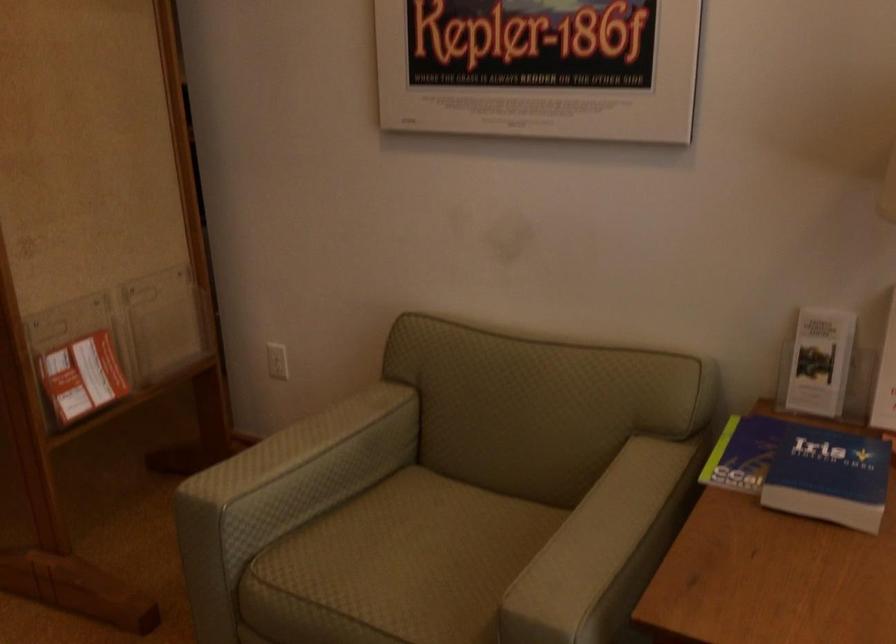
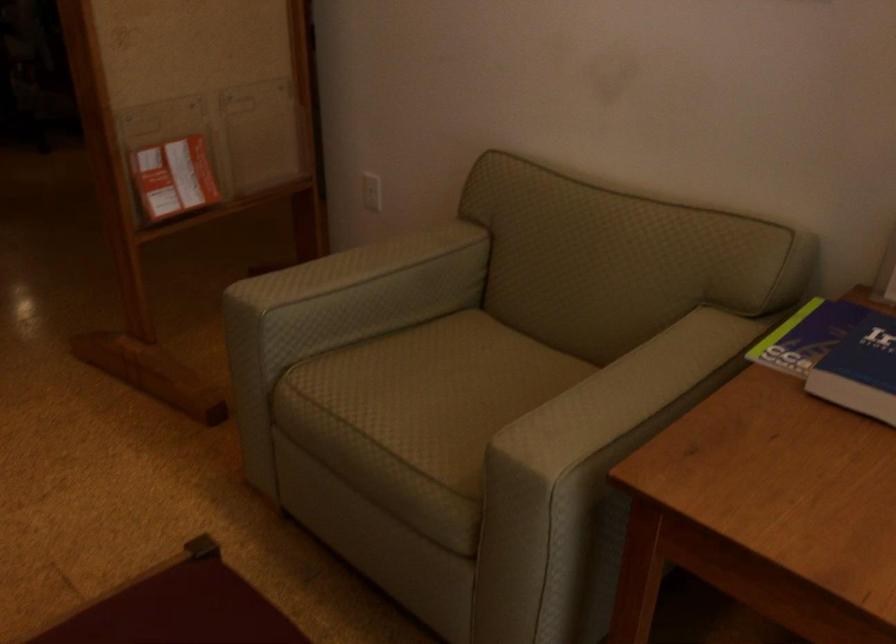
Question: The first image is from the beginning of the video and the second image is from the end. How did the camera likely rotate when shooting the video?

Choices:
 (A) Left
 (B) Right
 (C) Up
 (D) Down

Answer: (D)